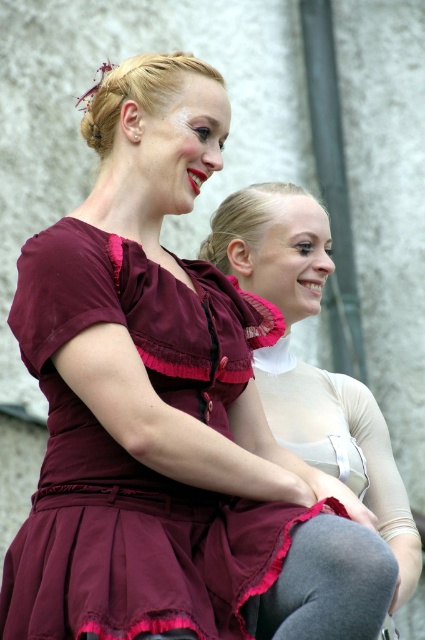
Question: Can you confirm if burgundy satin dress at center is bigger than matte burgundy dress at center?

Choices:
 (A) yes
 (B) no

Answer: (A)

Question: Considering the relative positions of burgundy satin dress at center and matte burgundy dress at center in the image provided, where is burgundy satin dress at center located with respect to matte burgundy dress at center?

Choices:
 (A) left
 (B) right

Answer: (A)

Question: Which point appears farthest from the camera in this image?

Choices:
 (A) (351, 468)
 (B) (82, 513)

Answer: (A)

Question: Considering the relative positions of burgundy satin dress at center and matte burgundy dress at center in the image provided, where is burgundy satin dress at center located with respect to matte burgundy dress at center?

Choices:
 (A) below
 (B) above

Answer: (A)